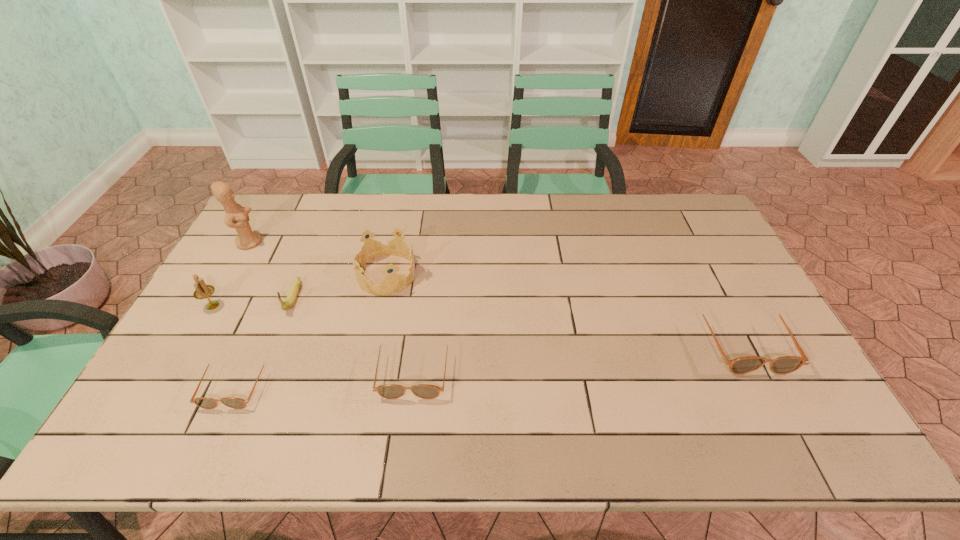
This screenshot has height=540, width=960. Identify the location of object that is at the right edge. (787, 364).

Image resolution: width=960 pixels, height=540 pixels. In order to click on object that is positioned at the far left corner in this screenshot , I will do `click(237, 217)`.

This screenshot has height=540, width=960. I want to click on object that is at the near left corner, so click(x=203, y=402).

In order to click on object situated at the near right corner in this screenshot , I will do `click(787, 364)`.

Where is `vacant position at the far edge of the desktop`? vacant position at the far edge of the desktop is located at coordinates (486, 209).

I want to click on free region at the near edge of the desktop, so click(272, 397).

Where is `vacant space at the right edge of the desktop`? vacant space at the right edge of the desktop is located at coordinates (734, 313).

The height and width of the screenshot is (540, 960). I want to click on free location at the far left corner, so click(x=283, y=195).

The height and width of the screenshot is (540, 960). In order to click on vacant space at the near left corner of the desktop in this screenshot , I will do `click(174, 394)`.

What are the coordinates of `free location at the far right corner of the desktop` in the screenshot? It's located at (701, 205).